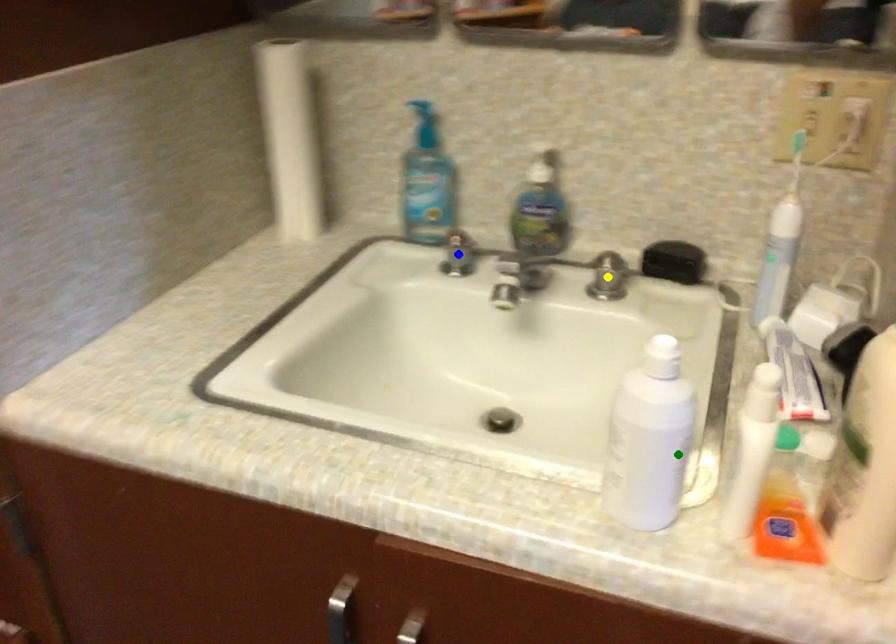
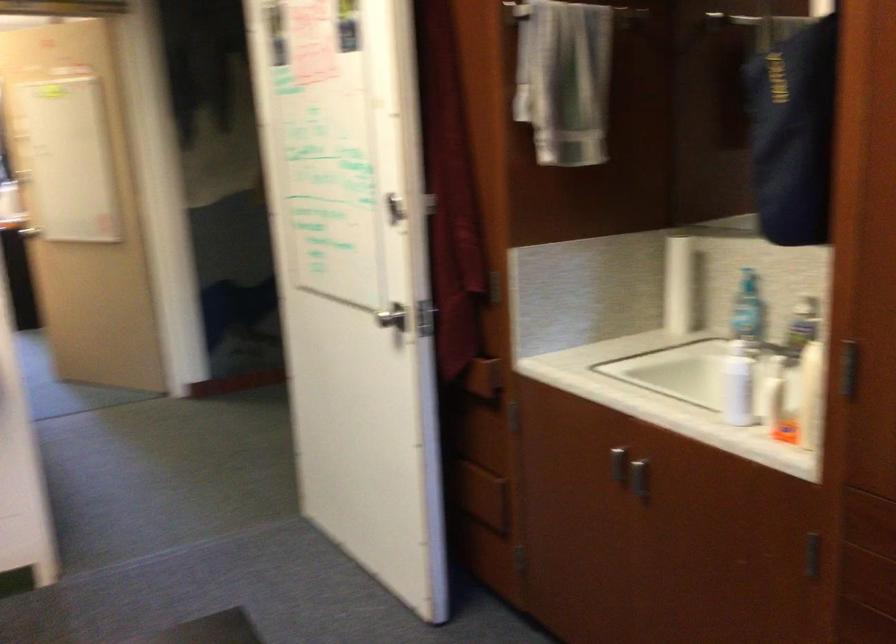
I am providing you with two images of the same scene from different viewpoints. Three points are marked in image1. Which point corresponds to a part or object that is occluded in image2?In image1, three points are marked. Which of them correspond to a part or object that is occluded in image2?Among the three points shown in image1, which one corresponds to a part or object that is no longer visible due to occlusion in image2?

yellow point, blue point